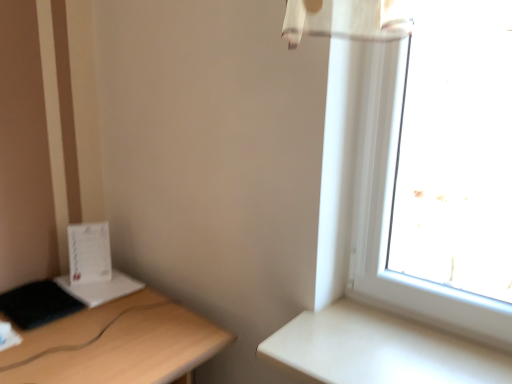
Question: From a real-world perspective, relative to white matte table at right, is light wood desk at left vertically above or below?

Choices:
 (A) below
 (B) above

Answer: (A)

Question: In terms of size, does light wood desk at left appear bigger or smaller than white matte table at right?

Choices:
 (A) small
 (B) big

Answer: (B)

Question: Looking at their shapes, would you say light wood desk at left is wider or thinner than white matte table at right?

Choices:
 (A) wide
 (B) thin

Answer: (A)

Question: From a real-world perspective, relative to light wood desk at left, is white matte table at right vertically above or below?

Choices:
 (A) above
 (B) below

Answer: (A)

Question: Considering the positions of white matte table at right and light wood desk at left in the image, is white matte table at right wider or thinner than light wood desk at left?

Choices:
 (A) wide
 (B) thin

Answer: (B)

Question: From their relative heights in the image, would you say white matte table at right is taller or shorter than light wood desk at left?

Choices:
 (A) short
 (B) tall

Answer: (A)

Question: From the image's perspective, is white matte table at right positioned above or below light wood desk at left?

Choices:
 (A) above
 (B) below

Answer: (A)